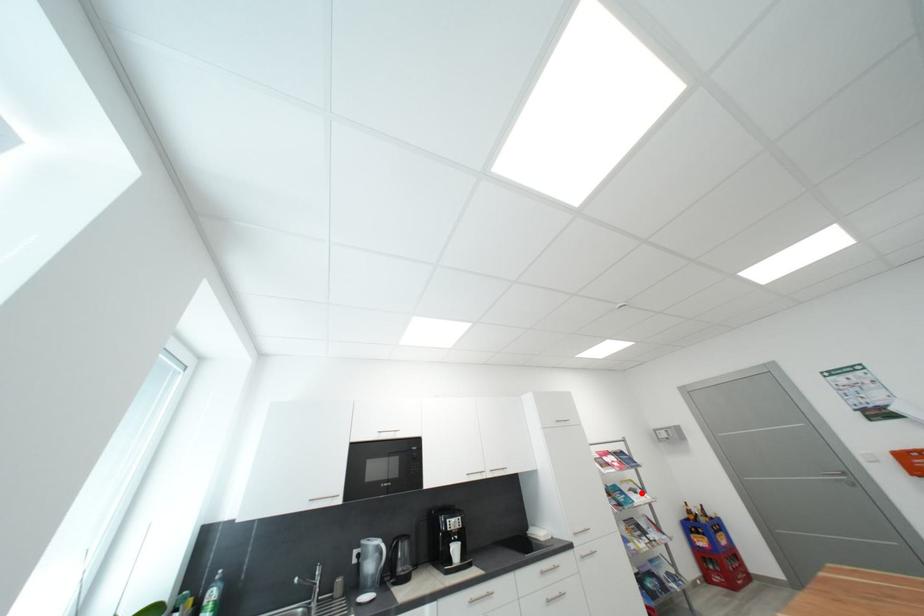
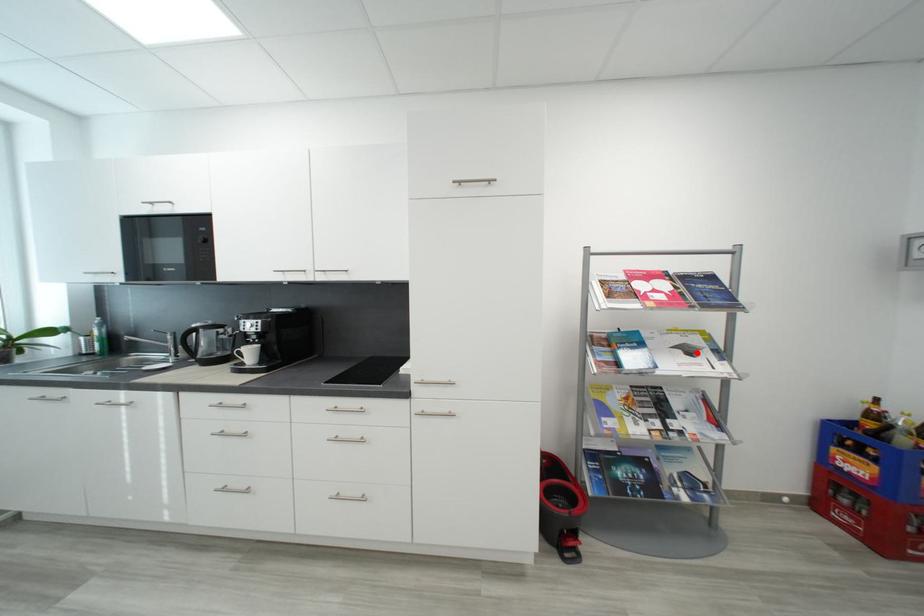
I am providing you with two images of the same scene from different viewpoints. A red point is marked on the first image and another point is marked on the second image. Do the highlighted points in image1 and image2 indicate the same real-world spot?

Yes